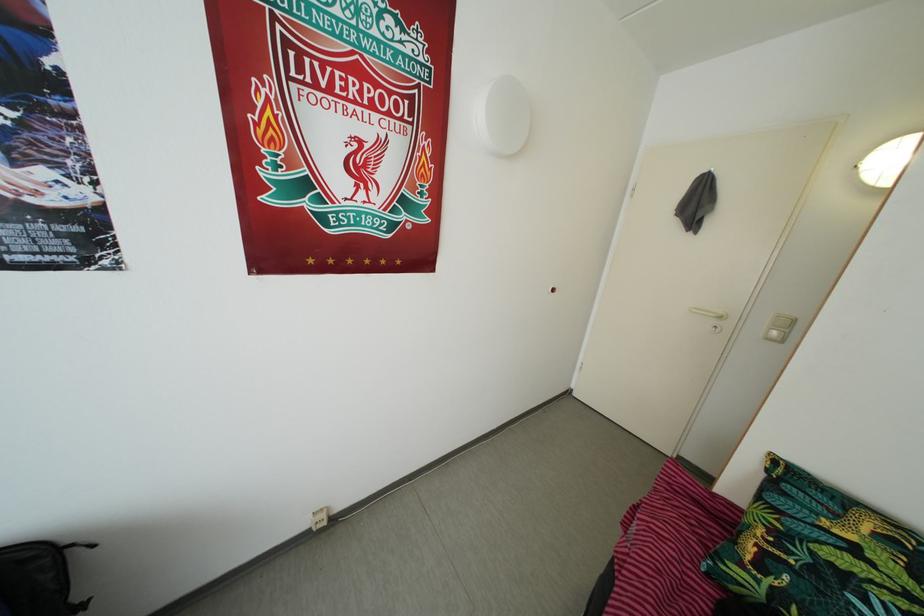
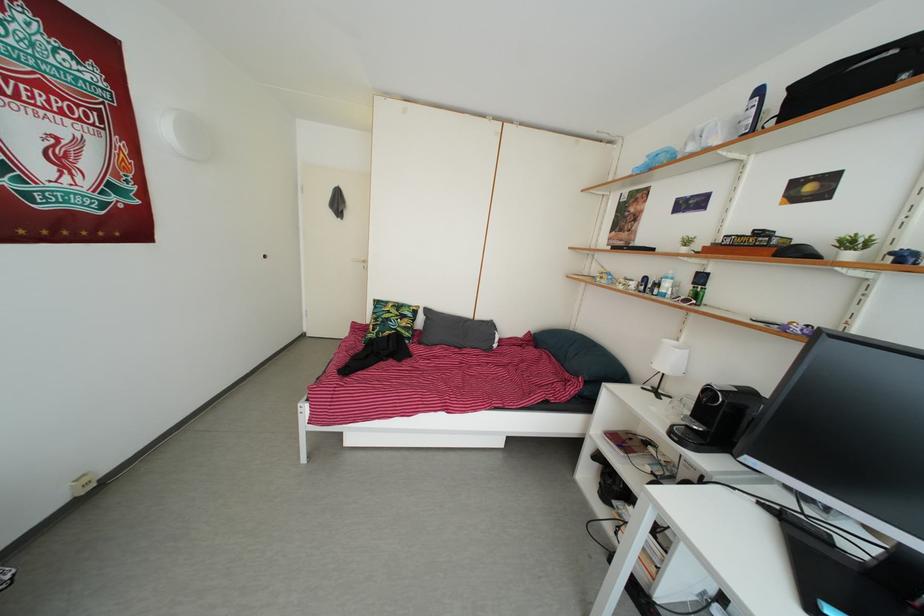
The point at [820,578] is marked in the first image. Where is the corresponding point in the second image?

(388, 330)